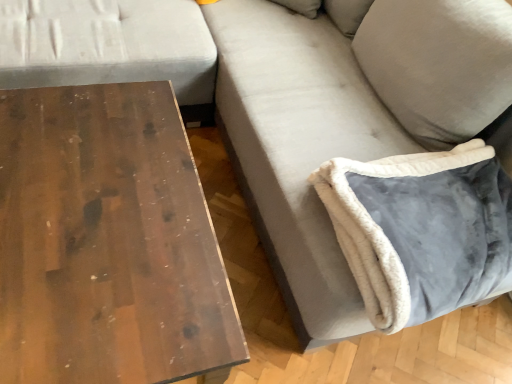
Question: Would you say wooden table at left contains velvet gray pillow at lower right?

Choices:
 (A) no
 (B) yes

Answer: (A)

Question: Considering the relative sizes of wooden table at left and velvet gray pillow at lower right in the image provided, is wooden table at left shorter than velvet gray pillow at lower right?

Choices:
 (A) no
 (B) yes

Answer: (A)

Question: Is wooden table at left further to the viewer compared to velvet gray pillow at lower right?

Choices:
 (A) yes
 (B) no

Answer: (B)

Question: Does wooden table at left have a greater height compared to velvet gray pillow at lower right?

Choices:
 (A) yes
 (B) no

Answer: (A)

Question: Is wooden table at left beside velvet gray pillow at lower right?

Choices:
 (A) no
 (B) yes

Answer: (A)

Question: From the image's perspective, is wooden table at left above velvet gray pillow at lower right?

Choices:
 (A) yes
 (B) no

Answer: (B)

Question: Would you say velvet gray pillow at lower right is a long distance from wooden table at left?

Choices:
 (A) yes
 (B) no

Answer: (B)

Question: Considering the relative sizes of velvet gray pillow at lower right and wooden table at left in the image provided, is velvet gray pillow at lower right wider than wooden table at left?

Choices:
 (A) yes
 (B) no

Answer: (B)

Question: From the image's perspective, is velvet gray pillow at lower right located beneath wooden table at left?

Choices:
 (A) no
 (B) yes

Answer: (A)

Question: Is velvet gray pillow at lower right thinner than wooden table at left?

Choices:
 (A) yes
 (B) no

Answer: (A)

Question: Is velvet gray pillow at lower right positioned with its back to wooden table at left?

Choices:
 (A) yes
 (B) no

Answer: (B)

Question: Does velvet gray pillow at lower right have a greater height compared to wooden table at left?

Choices:
 (A) no
 (B) yes

Answer: (A)

Question: Is velvet gray pillow at lower right wider or thinner than wooden table at left?

Choices:
 (A) thin
 (B) wide

Answer: (A)